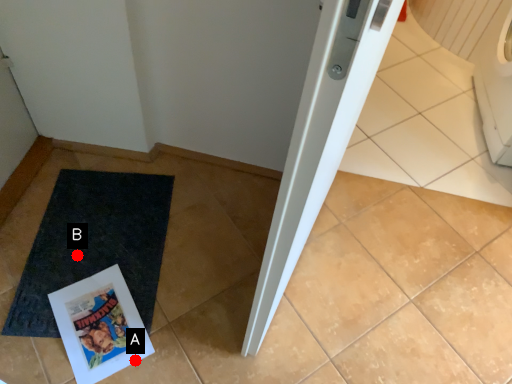
Question: Two points are circled on the image, labeled by A and B beside each circle. Which of the following is the farthest from the observer?

Choices:
 (A) A is further
 (B) B is further

Answer: (B)